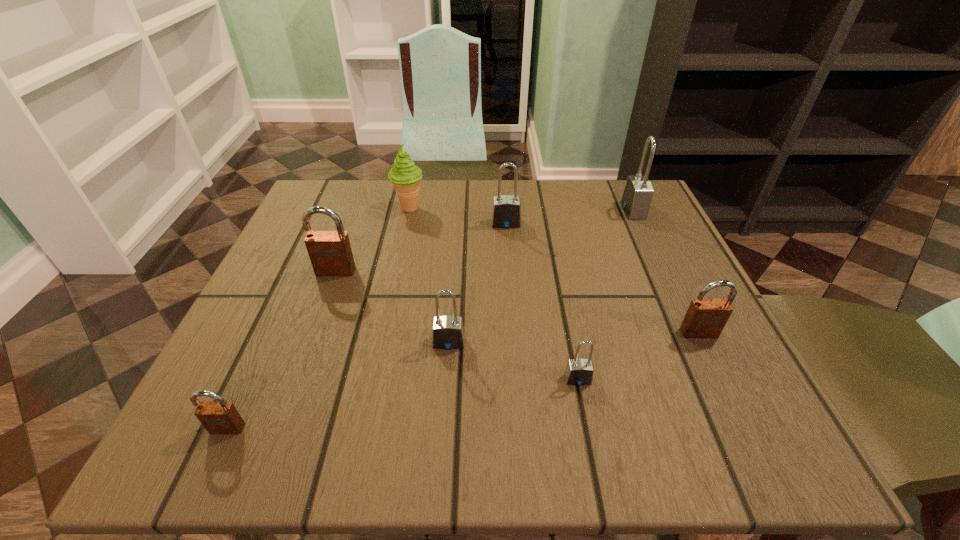
Where is `the tallest padlock`? The image size is (960, 540). the tallest padlock is located at coordinates (638, 192).

Locate an element on the screen. This screenshot has height=540, width=960. the biggest gray padlock is located at coordinates (638, 192).

Image resolution: width=960 pixels, height=540 pixels. I want to click on green icecream, so click(405, 176).

Find the location of `the third object from left to right`. the third object from left to right is located at coordinates (405, 176).

Where is `the fourth padlock from left to right`? The height and width of the screenshot is (540, 960). the fourth padlock from left to right is located at coordinates (506, 210).

This screenshot has height=540, width=960. Identify the location of the second biggest gray padlock. (506, 210).

Where is `the third farthest padlock`? the third farthest padlock is located at coordinates (330, 253).

You are a GUI agent. You are given a task and a screenshot of the screen. Output one action in this format:
    pyautogui.click(x=<x>, y=<y>)
    Task: Click on the sixth padlock from right to left
    
    Given the screenshot: What is the action you would take?
    pyautogui.click(x=330, y=253)

Identify the location of the fourth object from left to right. The image size is (960, 540). (447, 332).

The height and width of the screenshot is (540, 960). I want to click on the leftmost gray padlock, so click(x=447, y=332).